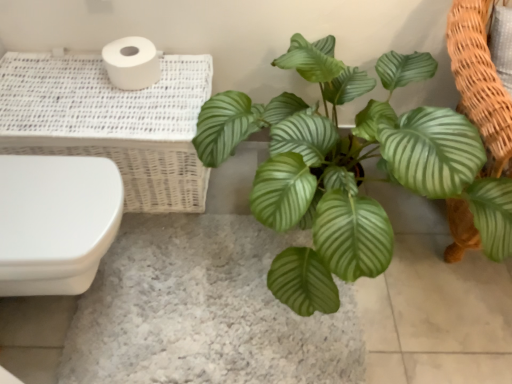
Question: Does green glossy leafy plant at center turn towards white wicker basket at upper left?

Choices:
 (A) yes
 (B) no

Answer: (B)

Question: Is green glossy leafy plant at center turned away from white wicker basket at upper left?

Choices:
 (A) no
 (B) yes

Answer: (A)

Question: Does green glossy leafy plant at center come in front of white wicker basket at upper left?

Choices:
 (A) no
 (B) yes

Answer: (B)

Question: From the image's perspective, is green glossy leafy plant at center located beneath white wicker basket at upper left?

Choices:
 (A) no
 (B) yes

Answer: (B)

Question: From a real-world perspective, is green glossy leafy plant at center positioned under white wicker basket at upper left based on gravity?

Choices:
 (A) no
 (B) yes

Answer: (A)

Question: Is white glossy toilet at left in front of or behind green leafy plant at center in the image?

Choices:
 (A) front
 (B) behind

Answer: (A)

Question: Based on their sizes in the image, would you say white glossy toilet at left is bigger or smaller than green leafy plant at center?

Choices:
 (A) small
 (B) big

Answer: (B)

Question: Looking at their shapes, would you say white glossy toilet at left is wider or thinner than green leafy plant at center?

Choices:
 (A) thin
 (B) wide

Answer: (A)

Question: Is point coord(29,165) positioned closer to the camera than point coord(216,309)?

Choices:
 (A) farther
 (B) closer

Answer: (B)

Question: From the image's perspective, is green glossy leafy plant at center above or below white glossy toilet at left?

Choices:
 (A) below
 (B) above

Answer: (B)

Question: Is green glossy leafy plant at center wider or thinner than white glossy toilet at left?

Choices:
 (A) thin
 (B) wide

Answer: (B)

Question: Is green glossy leafy plant at center in front of or behind white glossy toilet at left in the image?

Choices:
 (A) front
 (B) behind

Answer: (A)

Question: Would you say green glossy leafy plant at center is to the left or to the right of white glossy toilet at left in the picture?

Choices:
 (A) right
 (B) left

Answer: (A)

Question: From the image's perspective, is white glossy toilet at left above or below white wicker basket at upper left?

Choices:
 (A) above
 (B) below

Answer: (B)

Question: Is white glossy toilet at left situated inside white wicker basket at upper left or outside?

Choices:
 (A) inside
 (B) outside

Answer: (B)